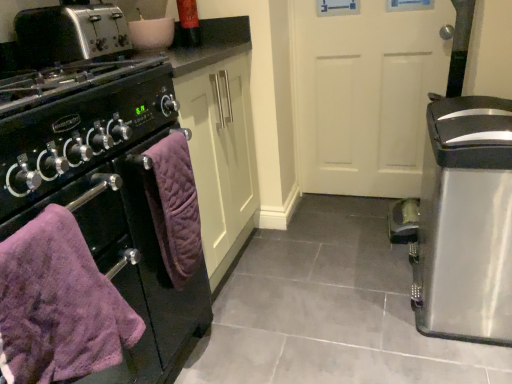
Question: From a real-world perspective, is purple quilted towel at lower left, which appears as the 2th bath towel when viewed from the front, located higher than purple quilted towel at left, arranged as the second bath towel when viewed from the back?

Choices:
 (A) no
 (B) yes

Answer: (A)

Question: Is the position of purple quilted towel at lower left, the 1th bath towel when ordered from back to front, more distant than that of purple quilted towel at left, the first bath towel in the front-to-back sequence?

Choices:
 (A) yes
 (B) no

Answer: (A)

Question: Considering the relative sizes of purple quilted towel at lower left, which appears as the 2th bath towel when viewed from the front, and purple quilted towel at left, arranged as the second bath towel when viewed from the back, in the image provided, is purple quilted towel at lower left, which appears as the 2th bath towel when viewed from the front, bigger than purple quilted towel at left, arranged as the second bath towel when viewed from the back,?

Choices:
 (A) yes
 (B) no

Answer: (B)

Question: Can you confirm if purple quilted towel at lower left, which appears as the 2th bath towel when viewed from the front, is thinner than purple quilted towel at left, arranged as the second bath towel when viewed from the back?

Choices:
 (A) yes
 (B) no

Answer: (A)

Question: From a real-world perspective, is purple quilted towel at lower left, the 1th bath towel when ordered from back to front, physically below purple quilted towel at left, arranged as the second bath towel when viewed from the back?

Choices:
 (A) no
 (B) yes

Answer: (B)

Question: Looking at their shapes, would you say purple quilted towel at lower left, the 1th bath towel when ordered from back to front, is wider or thinner than purple quilted towel at left, the first bath towel in the front-to-back sequence?

Choices:
 (A) wide
 (B) thin

Answer: (B)

Question: Considering the positions of purple quilted towel at lower left, the 1th bath towel when ordered from back to front, and purple quilted towel at left, the first bath towel in the front-to-back sequence, in the image, is purple quilted towel at lower left, the 1th bath towel when ordered from back to front, taller or shorter than purple quilted towel at left, the first bath towel in the front-to-back sequence,?

Choices:
 (A) short
 (B) tall

Answer: (B)

Question: From the image's perspective, is purple quilted towel at lower left, the 1th bath towel when ordered from back to front, above or below purple quilted towel at left, the first bath towel in the front-to-back sequence?

Choices:
 (A) below
 (B) above

Answer: (B)

Question: Considering the positions of point (193, 195) and point (117, 304), is point (193, 195) closer or farther from the camera than point (117, 304)?

Choices:
 (A) closer
 (B) farther

Answer: (B)

Question: In terms of height, does white matte door at center look taller or shorter compared to silver metallic toaster at upper left?

Choices:
 (A) short
 (B) tall

Answer: (B)

Question: Considering the positions of point [361, 100] and point [70, 54], is point [361, 100] closer or farther from the camera than point [70, 54]?

Choices:
 (A) closer
 (B) farther

Answer: (B)

Question: Looking at their shapes, would you say white matte door at center is wider or thinner than silver metallic toaster at upper left?

Choices:
 (A) wide
 (B) thin

Answer: (B)

Question: Considering their positions, is white matte door at center located in front of or behind silver metallic toaster at upper left?

Choices:
 (A) front
 (B) behind

Answer: (B)

Question: Do you think silver metallic toaster at upper left is within satin silver trash can at right, or outside of it?

Choices:
 (A) outside
 (B) inside

Answer: (A)

Question: In terms of height, does silver metallic toaster at upper left look taller or shorter compared to satin silver trash can at right?

Choices:
 (A) short
 (B) tall

Answer: (A)